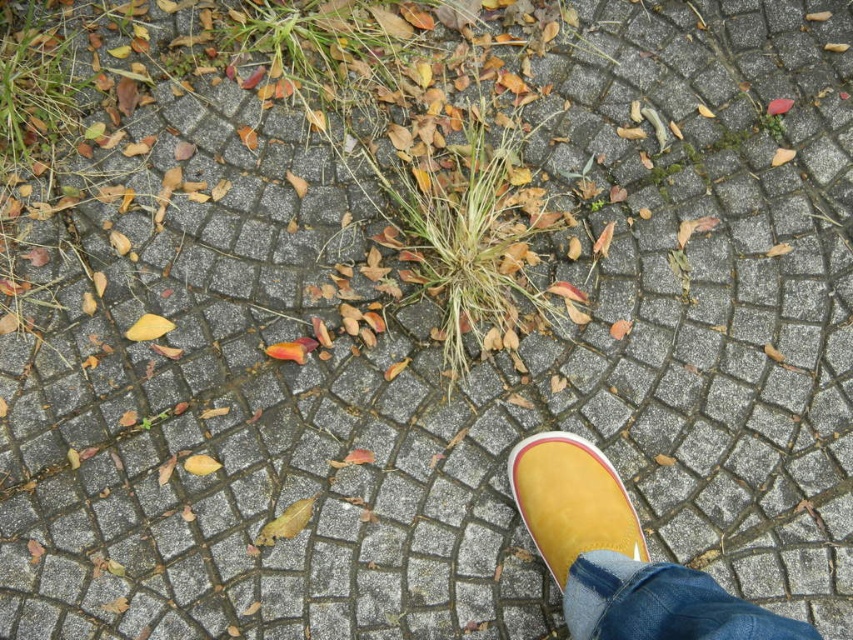
Is yellow rubber boot at lower right further to camera compared to yellow suede shoe at lower right?

No.

Looking at this image, who is lower down, yellow rubber boot at lower right or yellow suede shoe at lower right?

yellow rubber boot at lower right is below.

Does point (535, 492) lie behind point (624, 513)?

That is True.

You are a GUI agent. You are given a task and a screenshot of the screen. Output one action in this format:
    pyautogui.click(x=<x>, y=<y>)
    Task: Click on the yellow rubber boot at lower right
    This screenshot has width=853, height=640.
    Given the screenshot: What is the action you would take?
    pyautogui.click(x=618, y=556)

Which is below, yellow rubber boot at lower right or denim at lower right?

denim at lower right is lower down.

Between point (573, 602) and point (746, 636), which one is positioned behind?

The point (573, 602) is behind.

The width and height of the screenshot is (853, 640). What are the coordinates of `yellow rubber boot at lower right` in the screenshot? It's located at (618, 556).

Based on the photo, which is more to the left, denim at lower right or yellow suede shoe at lower right?

Positioned to the left is yellow suede shoe at lower right.

Can you confirm if denim at lower right is positioned above yellow suede shoe at lower right?

No, denim at lower right is not above yellow suede shoe at lower right.

Which is in front, point (631, 637) or point (523, 486)?

Point (631, 637) is in front.

In order to click on denim at lower right in this screenshot , I will do `click(660, 604)`.